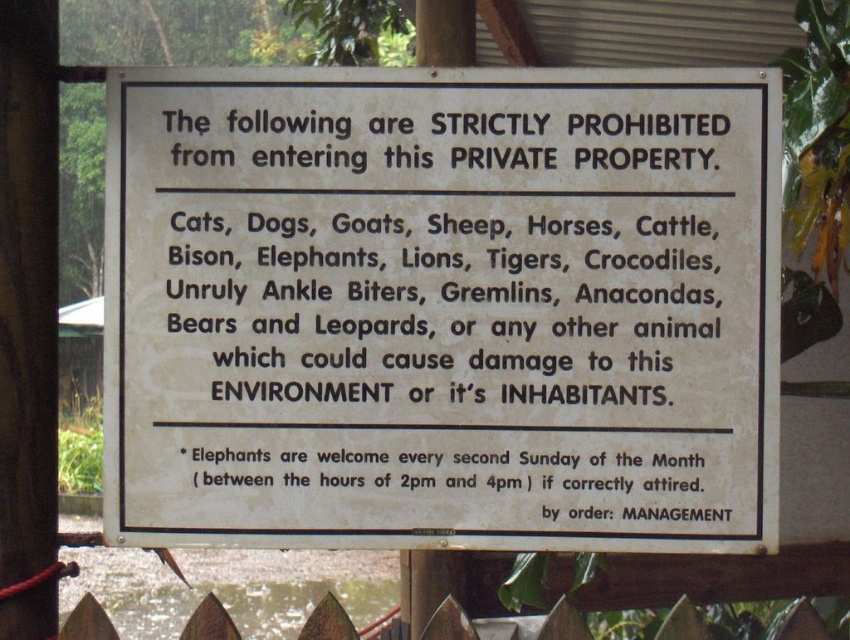
Question: Where is white paper sign at center located in relation to wooden picket fence at lower center in the image?

Choices:
 (A) below
 (B) above

Answer: (B)

Question: Does white paper sign at center appear on the right side of wooden picket fence at lower center?

Choices:
 (A) no
 (B) yes

Answer: (A)

Question: Does white paper sign at center appear over wooden picket fence at lower center?

Choices:
 (A) yes
 (B) no

Answer: (A)

Question: Which point is closer to the camera?

Choices:
 (A) wooden picket fence at lower center
 (B) white paper sign at center

Answer: (A)

Question: Which point appears farthest from the camera in this image?

Choices:
 (A) (272, 67)
 (B) (86, 628)

Answer: (A)

Question: Which of the following is the closest to the observer?

Choices:
 (A) white paper sign at center
 (B) wooden picket fence at lower center

Answer: (B)